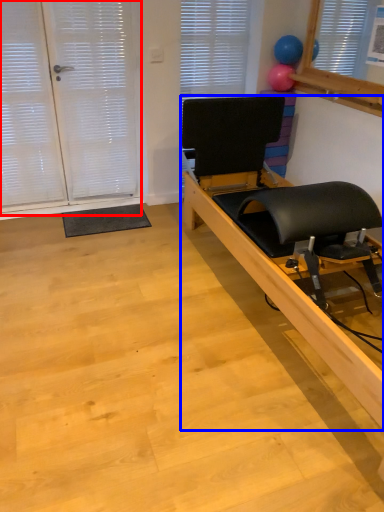
Question: Which of the following is the closest to the observer, screen door (highlighted by a red box) or furniture (highlighted by a blue box)?

Choices:
 (A) screen door
 (B) furniture

Answer: (B)